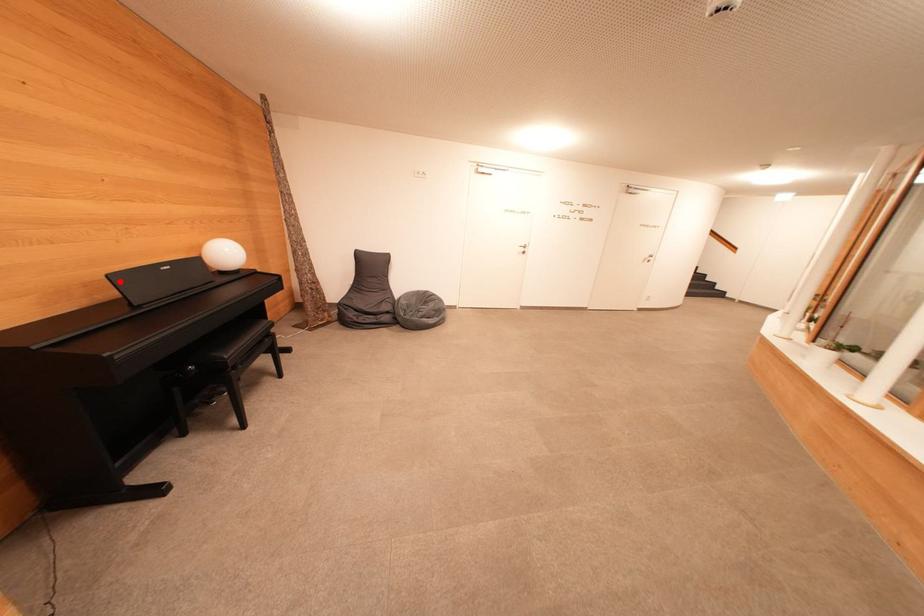
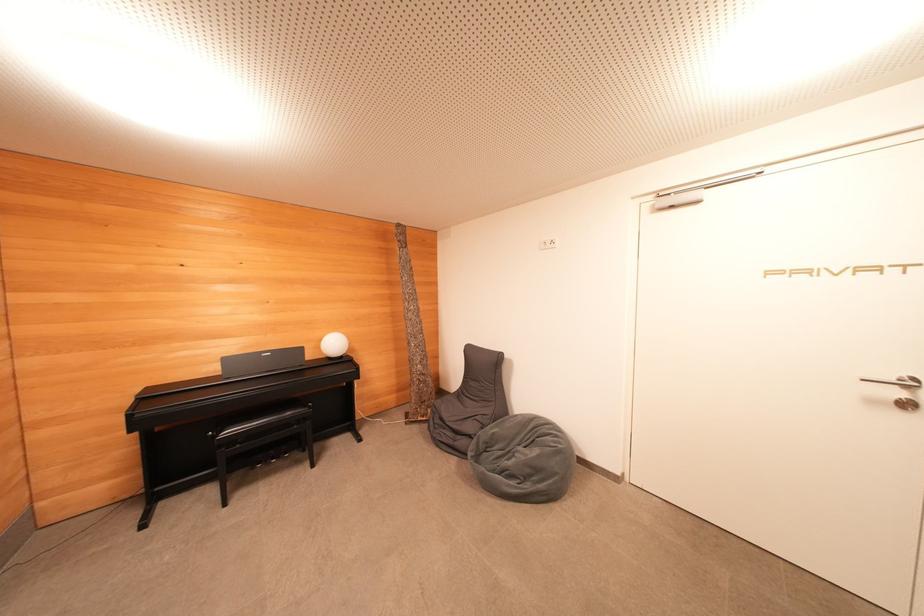
Locate, in the second image, the point that corresponds to the highlighted location in the first image.

(229, 363)